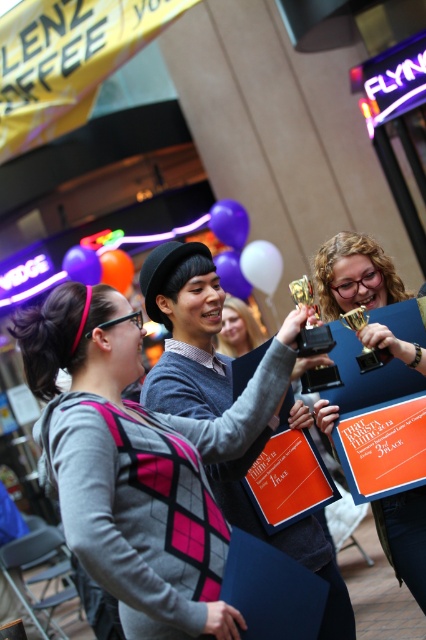
You are organizing a photo shoot and need to ensure that the shiny gold trophy at center and the matte gray sweater at center are both visible in the frame. Given their sizes, which object should you prioritize positioning closer to the camera to maintain clarity?

The shiny gold trophy at center has a smaller size compared to the matte gray sweater at center, so you should prioritize positioning the shiny gold trophy at center closer to the camera to ensure its details remain clear.